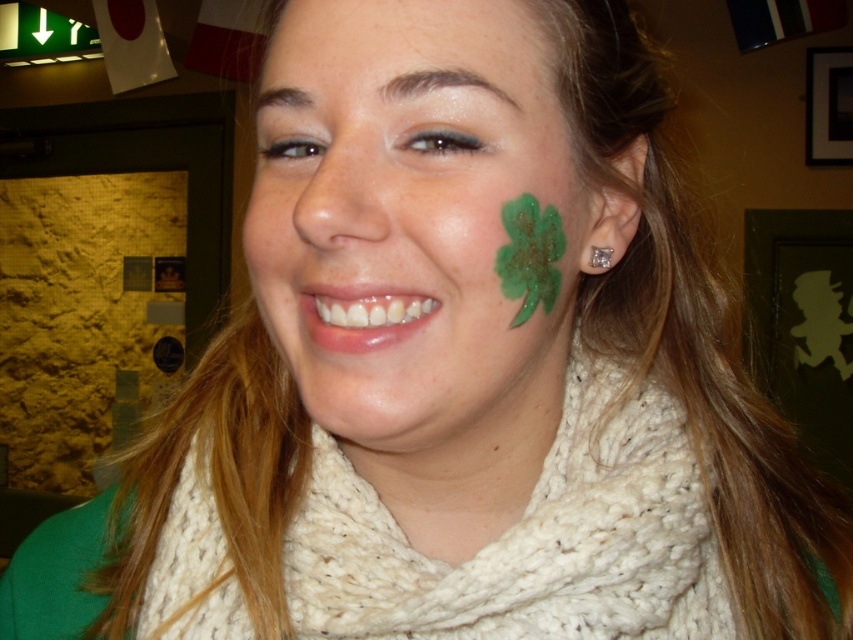
Question: Which object is closer to the camera taking this photo?

Choices:
 (A) white knitted scarf at center
 (B) clear crystal earring at ear

Answer: (A)

Question: Does green glittery shamrock at right appear over clear crystal earring at ear?

Choices:
 (A) yes
 (B) no

Answer: (B)

Question: Which object is closer to the camera taking this photo?

Choices:
 (A) white knitted scarf at center
 (B) clear crystal earring at ear
 (C) green glittery shamrock at right

Answer: (C)

Question: Is white knitted scarf at center below clear crystal earring at ear?

Choices:
 (A) no
 (B) yes

Answer: (B)

Question: In this image, where is green glittery shamrock at right located relative to clear crystal earring at ear?

Choices:
 (A) right
 (B) left

Answer: (B)

Question: Which of these objects is positioned farthest from the white knitted scarf at center?

Choices:
 (A) green glittery shamrock at right
 (B) clear crystal earring at ear

Answer: (B)